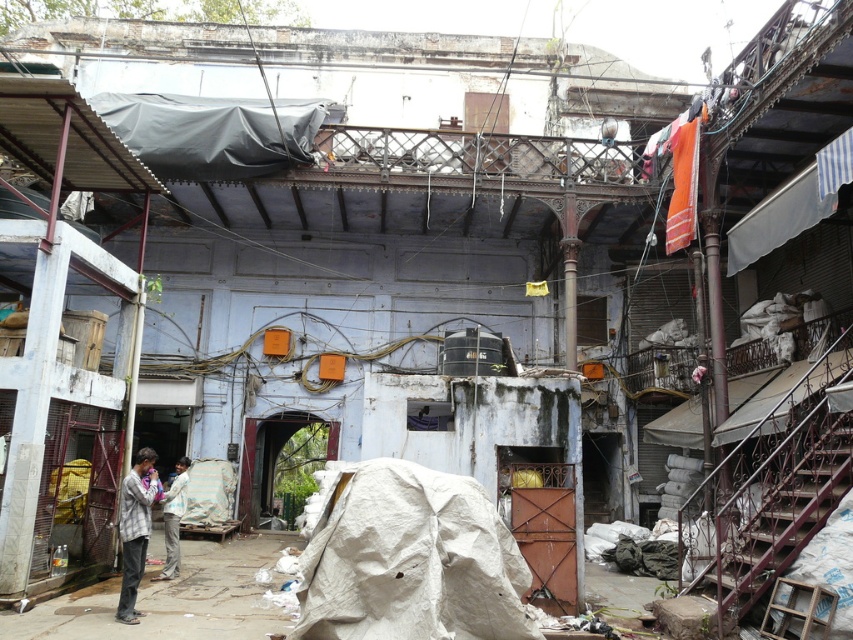
You are standing in the courtyard and need to locate the plaid fabric shirt at lower left. According to the coordinates provided, where should you look to find it?

The plaid fabric shirt at lower left is located at point (135, 529).

You are a tailor trying to determine if the plaid fabric shirt at lower left and the light brown fabric pants at lower left can be made from the same bolt of fabric. Given that the bolt has a fixed width, which of the two garments requires more fabric in terms of width?

The plaid fabric shirt at lower left requires more fabric in terms of width since its width surpasses that of the light brown fabric pants at lower left.